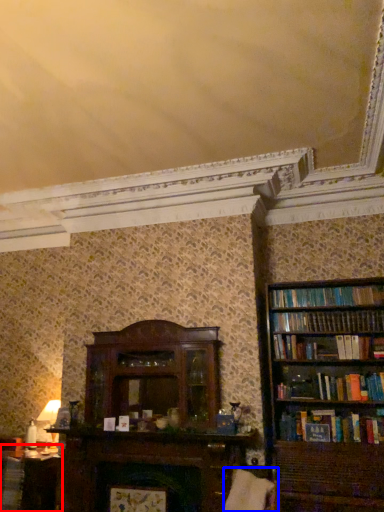
Question: Which point is closer to the camera, table (highlighted by a red box) or swivel chair (highlighted by a blue box)?

Choices:
 (A) table
 (B) swivel chair

Answer: (B)